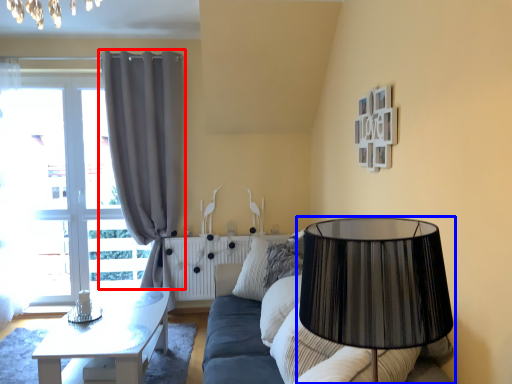
Question: Which object appears farthest to the camera in this image, curtain (highlighted by a red box) or lamp (highlighted by a blue box)?

Choices:
 (A) curtain
 (B) lamp

Answer: (A)